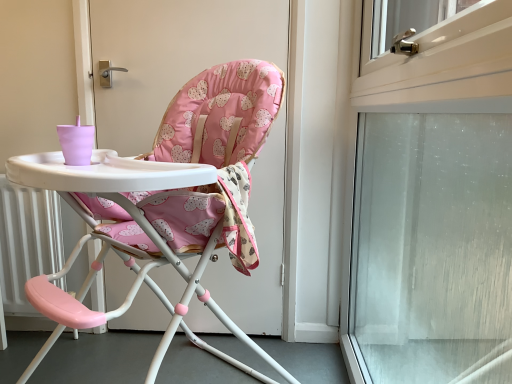
Question: Can you confirm if frosted glass screen door at right is bigger than pink fabric highchair at center?

Choices:
 (A) yes
 (B) no

Answer: (B)

Question: Is frosted glass screen door at right shorter than pink fabric highchair at center?

Choices:
 (A) no
 (B) yes

Answer: (A)

Question: Is frosted glass screen door at right positioned with its back to pink fabric highchair at center?

Choices:
 (A) no
 (B) yes

Answer: (B)

Question: Is frosted glass screen door at right to the left of pink fabric highchair at center from the viewer's perspective?

Choices:
 (A) no
 (B) yes

Answer: (A)

Question: Is pink fabric highchair at center a part of frosted glass screen door at right?

Choices:
 (A) yes
 (B) no

Answer: (B)

Question: Is frosted glass screen door at right not within pink fabric highchair at center?

Choices:
 (A) no
 (B) yes

Answer: (B)

Question: From a real-world perspective, does pink fabric highchair at center sit lower than frosted glass screen door at right?

Choices:
 (A) no
 (B) yes

Answer: (B)

Question: Is frosted glass screen door at right at the back of pink fabric highchair at center?

Choices:
 (A) no
 (B) yes

Answer: (A)

Question: Considering the relative sizes of pink fabric highchair at center and frosted glass screen door at right in the image provided, is pink fabric highchair at center thinner than frosted glass screen door at right?

Choices:
 (A) yes
 (B) no

Answer: (B)

Question: From the image's perspective, is pink fabric highchair at center beneath frosted glass screen door at right?

Choices:
 (A) no
 (B) yes

Answer: (B)

Question: Is pink fabric highchair at center bigger than frosted glass screen door at right?

Choices:
 (A) no
 (B) yes

Answer: (B)

Question: Does pink fabric highchair at center have a greater height compared to frosted glass screen door at right?

Choices:
 (A) no
 (B) yes

Answer: (A)

Question: From a real-world perspective, is frosted glass screen door at right physically located above or below pink fabric highchair at center?

Choices:
 (A) below
 (B) above

Answer: (B)